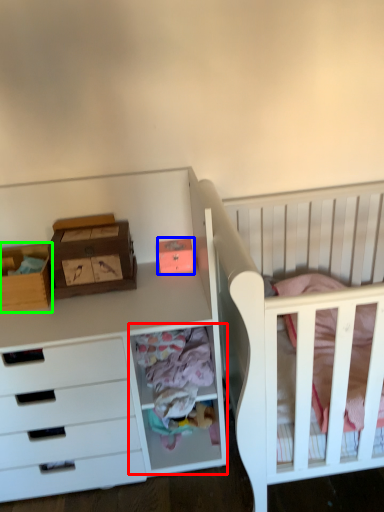
Question: Based on their relative distances, which object is farther from cabinet (highlighted by a red box)? Choose from storage box (highlighted by a blue box) and storage box (highlighted by a green box).

Choices:
 (A) storage box
 (B) storage box

Answer: (B)